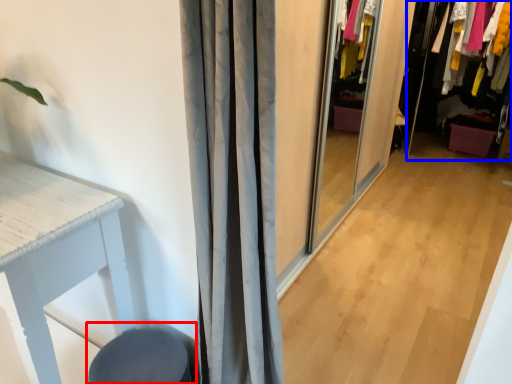
Question: Which object is closer to the camera taking this photo, swivel chair (highlighted by a red box) or closet (highlighted by a blue box)?

Choices:
 (A) swivel chair
 (B) closet

Answer: (A)